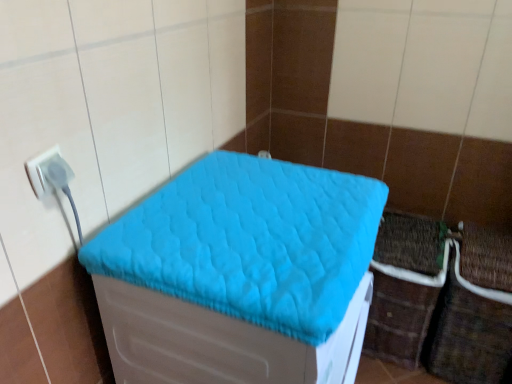
Find the location of a particular element. This screenshot has width=512, height=384. white plastic plug at left is located at coordinates (42, 172).

Considering the sizes of brown woven crate at lower right and white plastic plug at left in the image, is brown woven crate at lower right bigger or smaller than white plastic plug at left?

Clearly, brown woven crate at lower right is larger in size than white plastic plug at left.

Which point is more forward, [424,320] or [38,191]?

The point [38,191] is in front.

Does brown woven crate at lower right appear on the right side of white plastic plug at left?

Correct, you'll find brown woven crate at lower right to the right of white plastic plug at left.

Which object is positioned more to the left, turquoise quilted cushion at center or brown woven crate at lower right?

turquoise quilted cushion at center is more to the left.

Which object is further away from the camera taking this photo, turquoise quilted cushion at center or brown woven crate at lower right?

brown woven crate at lower right.

From the image's perspective, which one is positioned lower, turquoise quilted cushion at center or brown woven crate at lower right?

brown woven crate at lower right.

Is turquoise quilted cushion at center facing towards white plastic plug at left?

No, turquoise quilted cushion at center is not turned towards white plastic plug at left.

From a real-world perspective, between turquoise quilted cushion at center and white plastic plug at left, who is vertically higher?

white plastic plug at left, from a real-world perspective.

Looking at the image, does turquoise quilted cushion at center seem bigger or smaller compared to white plastic plug at left?

Considering their sizes, turquoise quilted cushion at center takes up more space than white plastic plug at left.

Looking at this image, who is taller, turquoise quilted cushion at center or white plastic plug at left?

Standing taller between the two is white plastic plug at left.

From a real-world perspective, is white plastic plug at left on turquoise quilted cushion at center?

Yes.

Choose the correct answer: Is white plastic plug at left inside turquoise quilted cushion at center or outside it?

white plastic plug at left is located beyond the bounds of turquoise quilted cushion at center.

From the image's perspective, is white plastic plug at left over turquoise quilted cushion at center?

Yes, from the image's perspective, white plastic plug at left is above turquoise quilted cushion at center.

From the image's perspective, between brown woven crate at lower right and turquoise quilted cushion at center, which one is located above?

turquoise quilted cushion at center appears higher in the image.

Is brown woven crate at lower right facing towards turquoise quilted cushion at center?

No, brown woven crate at lower right is not facing towards turquoise quilted cushion at center.

Would you say white plastic plug at left is a long distance from brown woven crate at lower right?

Yes.

Identify the location of crate on the right of white plastic plug at left. (405, 286).

Which point is more distant from viewer, (40,177) or (414,333)?

The point (414,333) is more distant.

From a real-world perspective, which is physically above, white plastic plug at left or brown woven crate at lower right?

In real-world perspective, white plastic plug at left is above.

The image size is (512, 384). What are the coordinates of `crate that appears behind the white plastic plug at left` in the screenshot? It's located at (405, 286).

You are a GUI agent. You are given a task and a screenshot of the screen. Output one action in this format:
    pyautogui.click(x=<x>, y=<y>)
    Task: Click on the furniture located above the brown woven crate at lower right (from the image's perspective)
    
    Given the screenshot: What is the action you would take?
    pyautogui.click(x=238, y=274)

Looking at the image, which one is located further to white plastic plug at left, brown woven crate at lower right or turquoise quilted cushion at center?

brown woven crate at lower right.

Considering their positions, is white plastic plug at left positioned further to turquoise quilted cushion at center than brown woven crate at lower right?

brown woven crate at lower right is positioned further to the anchor turquoise quilted cushion at center.

From the image, which object appears to be nearer to brown woven crate at lower right, white plastic plug at left or turquoise quilted cushion at center?

The object closer to brown woven crate at lower right is turquoise quilted cushion at center.

Looking at the image, which one is located closer to white plastic plug at left, turquoise quilted cushion at center or brown woven crate at lower right?

Based on the image, turquoise quilted cushion at center appears to be nearer to white plastic plug at left.

Based on their spatial positions, is brown woven crate at lower right or white plastic plug at left closer to turquoise quilted cushion at center?

Based on the image, white plastic plug at left appears to be nearer to turquoise quilted cushion at center.

Which object lies further to the anchor point brown woven crate at lower right, turquoise quilted cushion at center or white plastic plug at left?

Among the two, white plastic plug at left is located further to brown woven crate at lower right.

You are a GUI agent. You are given a task and a screenshot of the screen. Output one action in this format:
    pyautogui.click(x=<x>, y=<y>)
    Task: Click on the furniture located between white plastic plug at left and brown woven crate at lower right in the left-right direction
    
    Given the screenshot: What is the action you would take?
    pyautogui.click(x=238, y=274)